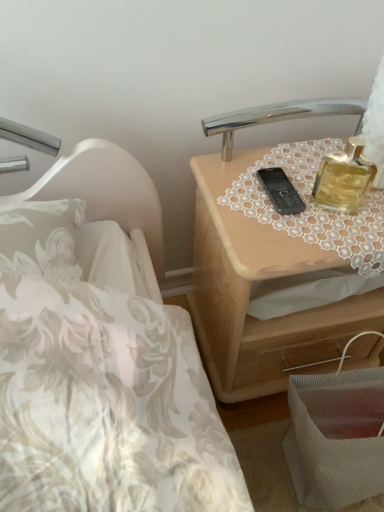
Question: Visually, is gold glass perfume at upper right positioned to the left or to the right of lace fabric at upper right?

Choices:
 (A) left
 (B) right

Answer: (A)

Question: Considering the positions of gold glass perfume at upper right and lace fabric at upper right in the image, is gold glass perfume at upper right wider or thinner than lace fabric at upper right?

Choices:
 (A) wide
 (B) thin

Answer: (B)

Question: Estimate the real-world distances between objects in this image. Which object is closer to the lace fabric at upper right?

Choices:
 (A) gold glass perfume at upper right
 (B) light wood nightstand at upper right

Answer: (A)

Question: Estimate the real-world distances between objects in this image. Which object is closer to the lace fabric at upper right?

Choices:
 (A) gold glass perfume at upper right
 (B) light wood nightstand at upper right

Answer: (A)